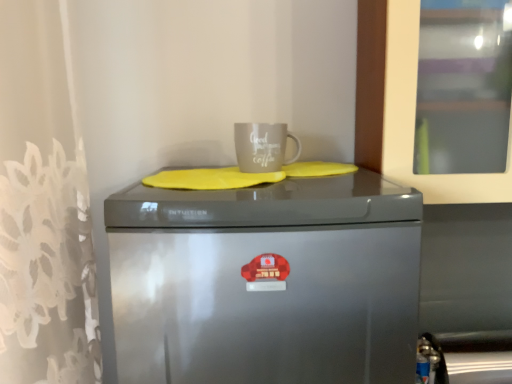
The width and height of the screenshot is (512, 384). Describe the element at coordinates (267, 281) in the screenshot. I see `satin silver fridge at center` at that location.

The width and height of the screenshot is (512, 384). I want to click on satin silver fridge at center, so click(267, 281).

This screenshot has width=512, height=384. What do you see at coordinates (262, 146) in the screenshot?
I see `white glossy mug at upper center` at bounding box center [262, 146].

What is the approximate width of white glossy mug at upper center?

white glossy mug at upper center is 12.29 centimeters in width.

Where is `white glossy mug at upper center`? Image resolution: width=512 pixels, height=384 pixels. white glossy mug at upper center is located at coordinates (262, 146).

You are a GUI agent. You are given a task and a screenshot of the screen. Output one action in this format:
    pyautogui.click(x=<x>, y=<y>)
    Task: Click on the satin silver fridge at center
    This screenshot has height=384, width=512.
    Given the screenshot: What is the action you would take?
    [267, 281]

Would you say satin silver fridge at center is to the left or to the right of white glossy mug at upper center in the picture?

From the image, it's evident that satin silver fridge at center is to the left of white glossy mug at upper center.

Considering their positions, is satin silver fridge at center located in front of or behind white glossy mug at upper center?

In the image, satin silver fridge at center appears in front of white glossy mug at upper center.

Which point is more forward, (324, 287) or (248, 125)?

Positioned in front is point (324, 287).

In the scene shown: From the image's perspective, does satin silver fridge at center appear lower than white glossy mug at upper center?

Yes, from the image's perspective, satin silver fridge at center is below white glossy mug at upper center.

From a real-world perspective, is satin silver fridge at center positioned over white glossy mug at upper center based on gravity?

No, from a real-world perspective, satin silver fridge at center is not over white glossy mug at upper center

Can you confirm if satin silver fridge at center is thinner than white glossy mug at upper center?

No.

Can you confirm if satin silver fridge at center is taller than white glossy mug at upper center?

Indeed, satin silver fridge at center has a greater height compared to white glossy mug at upper center.

Is satin silver fridge at center smaller than white glossy mug at upper center?

No.

Is satin silver fridge at center inside or outside of white glossy mug at upper center?

satin silver fridge at center is not inside white glossy mug at upper center, it's outside.

Consider the image. Is there a large distance between satin silver fridge at center and white glossy mug at upper center?

satin silver fridge at center is actually quite close to white glossy mug at upper center.

Is satin silver fridge at center facing away from white glossy mug at upper center?

That's not correct — satin silver fridge at center is not looking away from white glossy mug at upper center.

Can you tell me how much satin silver fridge at center and white glossy mug at upper center differ in facing direction?

1.92 degrees separate the facing orientations of satin silver fridge at center and white glossy mug at upper center.

Measure the distance from satin silver fridge at center to white glossy mug at upper center.

The distance of satin silver fridge at center from white glossy mug at upper center is 14.15 inches.

What are the coordinates of `mug above the satin silver fridge at center (from a real-world perspective)` in the screenshot? It's located at (262, 146).

Is white glossy mug at upper center at the left side of satin silver fridge at center?

Incorrect, white glossy mug at upper center is not on the left side of satin silver fridge at center.

Which object is closer to the camera, white glossy mug at upper center or satin silver fridge at center?

satin silver fridge at center is closer to the camera.

Is point (265, 126) less distant than point (133, 255)?

No, (265, 126) is behind (133, 255).

From the image's perspective, which object appears higher, white glossy mug at upper center or satin silver fridge at center?

From the image's view, white glossy mug at upper center is above.

From a real-world perspective, is white glossy mug at upper center positioned above or below satin silver fridge at center?

Clearly, from a real-world perspective, white glossy mug at upper center is above satin silver fridge at center.

Looking at their sizes, would you say white glossy mug at upper center is wider or thinner than satin silver fridge at center?

Clearly, white glossy mug at upper center has less width compared to satin silver fridge at center.

Is white glossy mug at upper center taller or shorter than satin silver fridge at center?

In the image, white glossy mug at upper center appears to be shorter than satin silver fridge at center.

In terms of size, does white glossy mug at upper center appear bigger or smaller than satin silver fridge at center?

Clearly, white glossy mug at upper center is smaller in size than satin silver fridge at center.

Is white glossy mug at upper center spatially inside satin silver fridge at center, or outside of it?

white glossy mug at upper center is outside satin silver fridge at center.

Would you say white glossy mug at upper center is a long distance from satin silver fridge at center?

No, there isn't a large distance between white glossy mug at upper center and satin silver fridge at center.

Is white glossy mug at upper center facing away from satin silver fridge at center?

white glossy mug at upper center does not have its back to satin silver fridge at center.

How many degrees apart are the facing directions of white glossy mug at upper center and satin silver fridge at center?

1.92 degrees.

Where is `mug located behind the satin silver fridge at center`? mug located behind the satin silver fridge at center is located at coordinates [x=262, y=146].

Where is `mug above the satin silver fridge at center (from the image's perspective)`? The height and width of the screenshot is (384, 512). mug above the satin silver fridge at center (from the image's perspective) is located at coordinates (262, 146).

This screenshot has width=512, height=384. Identify the location of home appliance that is under the white glossy mug at upper center (from a real-world perspective). (267, 281).